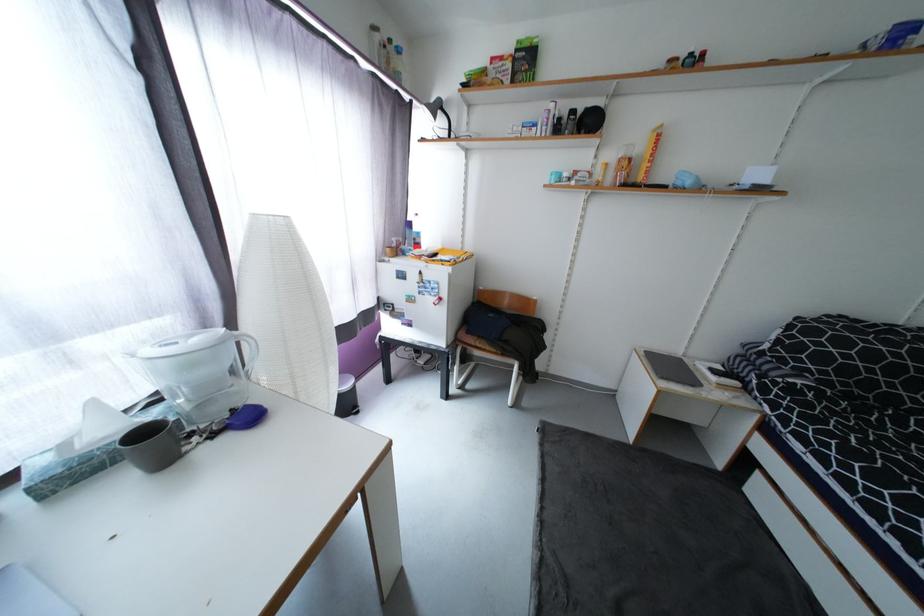
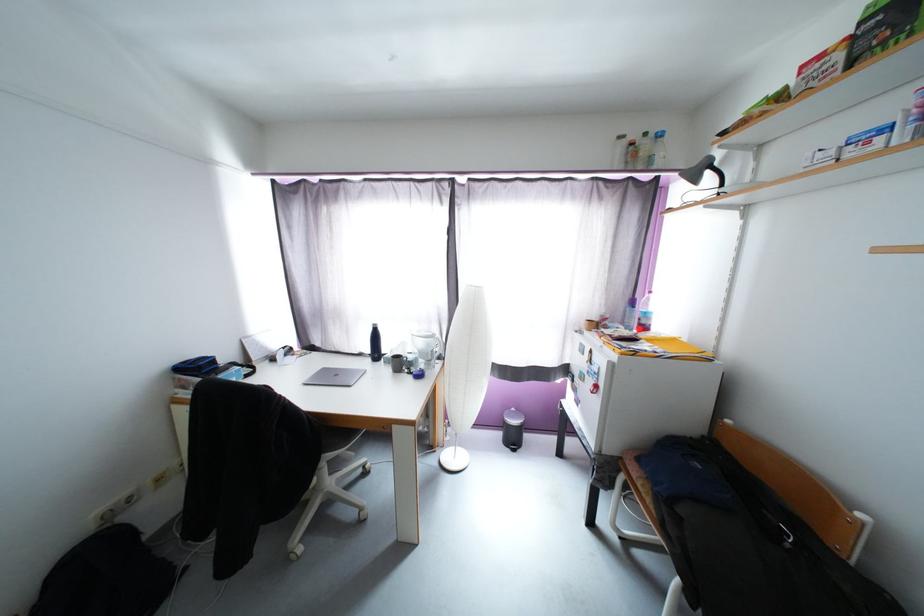
Find the pixel in the second image that matches (x=412, y=233) in the first image.

(634, 310)